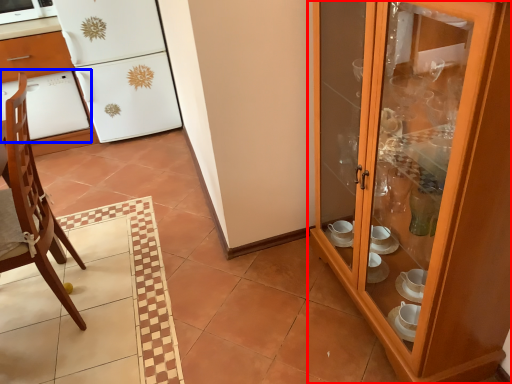
Question: Which of the following is the farthest to the observer, cupboard (highlighted by a red box) or oven (highlighted by a blue box)?

Choices:
 (A) cupboard
 (B) oven

Answer: (B)